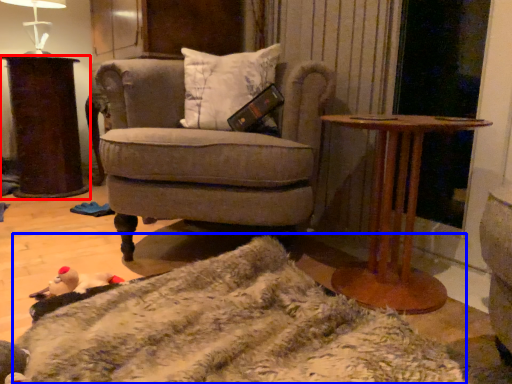
Question: Among these objects, which one is farthest to the camera, desk (highlighted by a red box) or blanket (highlighted by a blue box)?

Choices:
 (A) desk
 (B) blanket

Answer: (A)